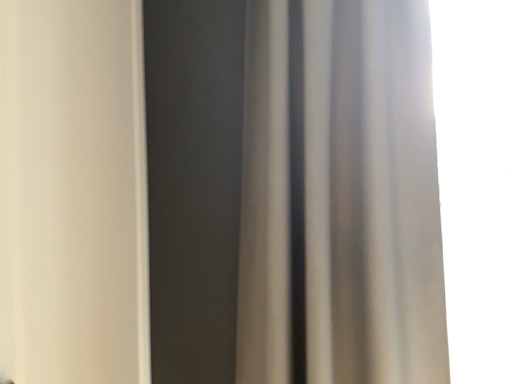
The height and width of the screenshot is (384, 512). Describe the element at coordinates (340, 197) in the screenshot. I see `white matte curtain at center` at that location.

Find the location of a particular element. white matte curtain at center is located at coordinates (340, 197).

Locate an element on the screen. The image size is (512, 384). white matte curtain at center is located at coordinates (340, 197).